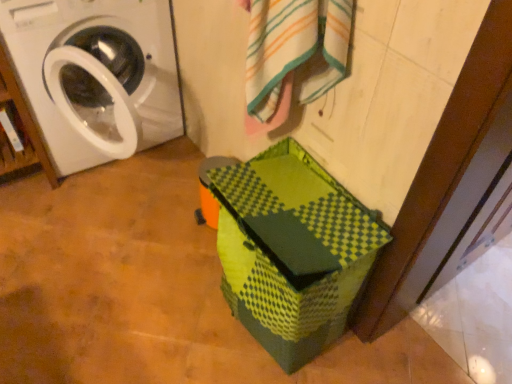
This screenshot has height=384, width=512. What are the coordinates of `matte white washing machine at left` in the screenshot? It's located at pyautogui.click(x=23, y=129).

What is the approximate height of white glossy washing machine at left?

It is 33.32 inches.

In order to click on white striped bath towel at upper center in this screenshot , I will do `click(295, 49)`.

This screenshot has width=512, height=384. I want to click on matte white washing machine at left, so click(x=23, y=129).

Which is farther, (344,1) or (6,102)?

Point (6,102)

From the image's perspective, which one is positioned higher, white striped bath towel at upper center or matte white washing machine at left?

matte white washing machine at left is shown above in the image.

Between white striped bath towel at upper center and matte white washing machine at left, which one is positioned in front?

white striped bath towel at upper center is more forward.

Can you confirm if white striped bath towel at upper center is wider than matte white washing machine at left?

In fact, white striped bath towel at upper center might be narrower than matte white washing machine at left.

From the picture: From a real-world perspective, relative to matte white washing machine at left, is white glossy washing machine at left vertically above or below?

Clearly, from a real-world perspective, white glossy washing machine at left is above matte white washing machine at left.

How different are the orientations of white glossy washing machine at left and matte white washing machine at left in degrees?

white glossy washing machine at left and matte white washing machine at left are facing 0.496 degrees away from each other.

Find the location of a particular element. shelf to the left of white glossy washing machine at left is located at coordinates (23, 129).

Considering the positions of objects white glossy washing machine at left and matte white washing machine at left in the image provided, who is in front, white glossy washing machine at left or matte white washing machine at left?

white glossy washing machine at left is closer to the camera.

Could you tell me if green matte cardboard box at lower center is facing white striped bath towel at upper center?

No, green matte cardboard box at lower center is not aimed at white striped bath towel at upper center.

Is point (296, 170) positioned before point (254, 28)?

No.

From a real-world perspective, is green matte cardboard box at lower center physically below white striped bath towel at upper center?

Yes.

Consider the image. Which is more to the right, green matte cardboard box at lower center or white striped bath towel at upper center?

white striped bath towel at upper center is more to the right.

Considering the positions of objects white glossy washing machine at left and green matte cardboard box at lower center in the image provided, who is in front, white glossy washing machine at left or green matte cardboard box at lower center?

green matte cardboard box at lower center is closer to the camera.

Based on the photo, from the image's perspective, is white glossy washing machine at left on green matte cardboard box at lower center?

Yes, from the image's perspective, white glossy washing machine at left is above green matte cardboard box at lower center.

Is white glossy washing machine at left to the right of green matte cardboard box at lower center from the viewer's perspective?

No.

From a real-world perspective, relative to green matte cardboard box at lower center, is white glossy washing machine at left vertically above or below?

Clearly, from a real-world perspective, white glossy washing machine at left is above green matte cardboard box at lower center.

Which is behind, point (344, 27) or point (67, 118)?

The point (67, 118) is behind.

Is white striped bath towel at upper center wider than white glossy washing machine at left?

Incorrect, the width of white striped bath towel at upper center does not surpass that of white glossy washing machine at left.

Find the location of a particular element. bath towel below the white glossy washing machine at left (from the image's perspective) is located at coordinates (295, 49).

Is white striped bath towel at upper center inside the boundaries of white glossy washing machine at left, or outside?

white striped bath towel at upper center cannot be found inside white glossy washing machine at left.

Which of these two, white glossy washing machine at left or white striped bath towel at upper center, is wider?

white glossy washing machine at left.

From the picture: Is white glossy washing machine at left beside white striped bath towel at upper center?

white glossy washing machine at left is not next to white striped bath towel at upper center, and they're not touching.

Is white glossy washing machine at left positioned with its back to white striped bath towel at upper center?

That's not correct — white glossy washing machine at left is not looking away from white striped bath towel at upper center.

Which is farther from the camera, (98, 160) or (336, 67)?

The point (98, 160) is more distant.

Can you see white striped bath towel at upper center touching green matte cardboard box at lower center?

There is a gap between white striped bath towel at upper center and green matte cardboard box at lower center.

Can you confirm if white striped bath towel at upper center is positioned to the right of green matte cardboard box at lower center?

Indeed, white striped bath towel at upper center is positioned on the right side of green matte cardboard box at lower center.

Image resolution: width=512 pixels, height=384 pixels. Find the location of `bath towel below the matte white washing machine at left (from the image's perspective)`. bath towel below the matte white washing machine at left (from the image's perspective) is located at coordinates (295, 49).

At what (x,y) coordinates should I click in order to perform the action: click on washing machine above the matte white washing machine at left (from a real-world perspective). Please return your answer as a coordinate pair (x, y). This screenshot has width=512, height=384. Looking at the image, I should click on (96, 75).

When comparing their distances from matte white washing machine at left, does white striped bath towel at upper center or green matte cardboard box at lower center seem further?

green matte cardboard box at lower center is further to matte white washing machine at left.

When comparing their distances from matte white washing machine at left, does white striped bath towel at upper center or white glossy washing machine at left seem closer?

white glossy washing machine at left is closer to matte white washing machine at left.

Estimate the real-world distances between objects in this image. Which object is closer to green matte cardboard box at lower center, white glossy washing machine at left or white striped bath towel at upper center?

Among the two, white striped bath towel at upper center is located nearer to green matte cardboard box at lower center.

Which object lies nearer to the anchor point green matte cardboard box at lower center, white glossy washing machine at left or matte white washing machine at left?

white glossy washing machine at left.

Which object lies nearer to the anchor point white striped bath towel at upper center, green matte cardboard box at lower center or white glossy washing machine at left?

Among the two, green matte cardboard box at lower center is located nearer to white striped bath towel at upper center.

From the picture: Which object lies further to the anchor point white striped bath towel at upper center, green matte cardboard box at lower center or matte white washing machine at left?

matte white washing machine at left.

Based on their spatial positions, is white striped bath towel at upper center or matte white washing machine at left closer to white glossy washing machine at left?

matte white washing machine at left.

When comparing their distances from green matte cardboard box at lower center, does matte white washing machine at left or white striped bath towel at upper center seem further?

matte white washing machine at left lies further to green matte cardboard box at lower center than the other object.

The image size is (512, 384). Find the location of `washing machine between matte white washing machine at left and green matte cardboard box at lower center`. washing machine between matte white washing machine at left and green matte cardboard box at lower center is located at coordinates [96, 75].

Identify the location of cardboard box between white glossy washing machine at left and white striped bath towel at upper center. (292, 250).

Locate an element on the screen. This screenshot has width=512, height=384. cardboard box between matte white washing machine at left and white striped bath towel at upper center in the horizontal direction is located at coordinates (292, 250).

At what (x,y) coordinates should I click in order to perform the action: click on washing machine between matte white washing machine at left and white striped bath towel at upper center. Please return your answer as a coordinate pair (x, y). The width and height of the screenshot is (512, 384). Looking at the image, I should click on (96, 75).